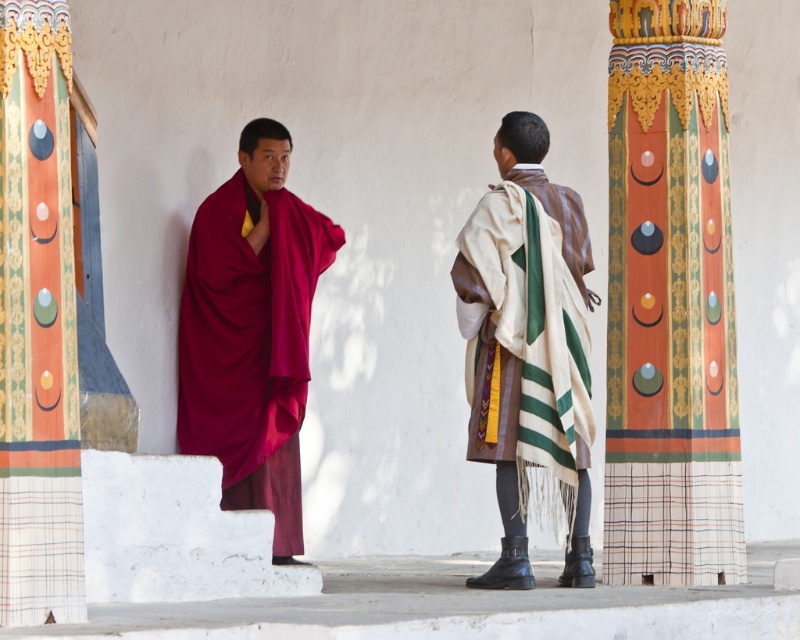
You are a visitor at this temple and want to take a photo of the painted wood column at right and the maroon silk robe at left. Which object should you focus on first if you want to capture both in one frame without moving the camera?

The painted wood column at right is located below the maroon silk robe at left, so you should focus on the maroon silk robe at left first to ensure both are in frame.

You are a visitor in this temple and want to take a photo of the painted wood column at right and the maroon silk robe at left. Which object should you focus on first if you want to capture both in a single frame without moving the camera?

The painted wood column at right is positioned on the right side of maroon silk robe at left, so you should focus on the maroon silk robe at left first to ensure both are in frame.

You are a photographer trying to capture a group photo of the maroon silk robe at left and the beige woven shawl at center. The camera you are using has a maximum focus range of 5 meters. Can you fit both objects into the frame without moving the camera?

The distance between the maroon silk robe at left and the beige woven shawl at center is 5.64 meters, which exceeds the camera maximum focus range of 5 meters. Therefore, you cannot fit both objects into the frame without moving the camera.